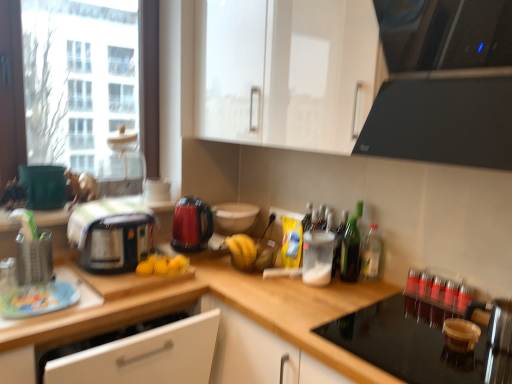
Identify the location of vacant space situated on the left part of translucent plastic container at center, the second appliance in the right-to-left sequence. This screenshot has height=384, width=512. (273, 281).